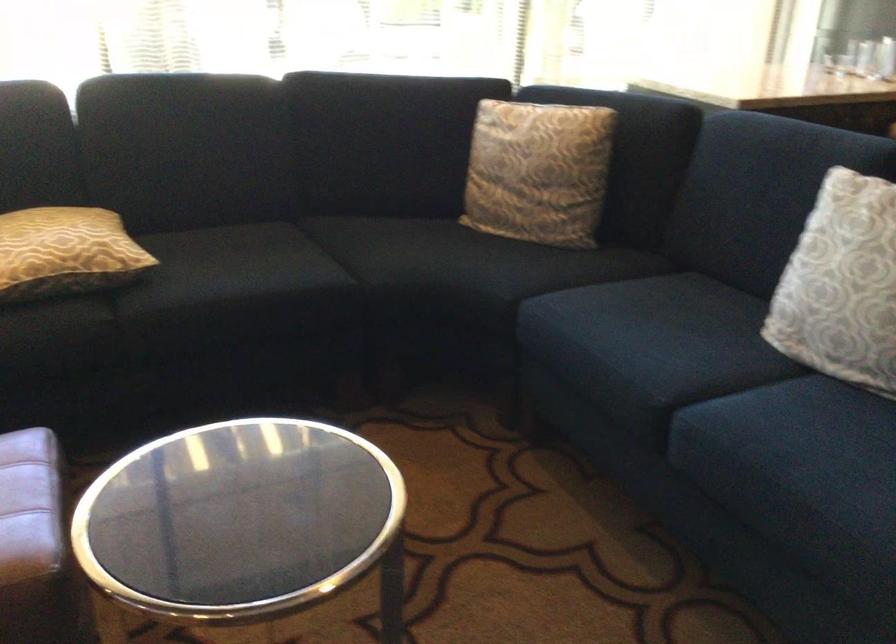
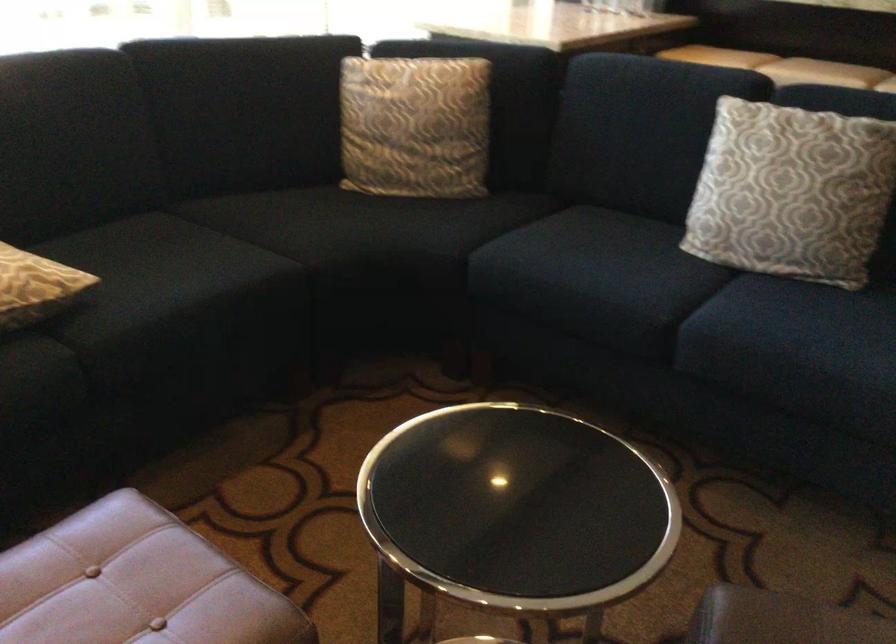
Where in the second image is the point corresponding to (x=374, y=142) from the first image?

(238, 111)